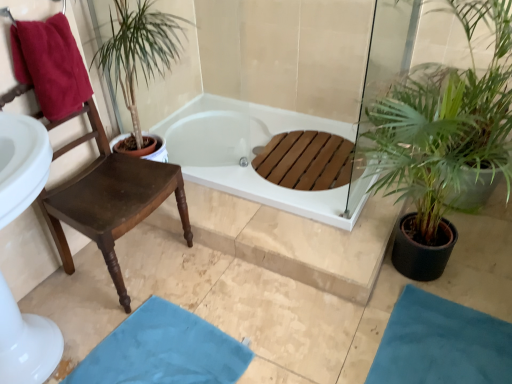
Question: Is blue fabric bath mat at lower right, which ranks as the second bath mat in left-to-right order, not inside green leafy plant at right?

Choices:
 (A) yes
 (B) no

Answer: (A)

Question: From the image's perspective, is blue fabric bath mat at lower right, which ranks as the second bath mat in left-to-right order, beneath green leafy plant at right?

Choices:
 (A) yes
 (B) no

Answer: (A)

Question: Is the surface of blue fabric bath mat at lower right, which appears as the first bath mat when viewed from the right, in direct contact with green leafy plant at right?

Choices:
 (A) yes
 (B) no

Answer: (B)

Question: Would you say green leafy plant at right is part of blue fabric bath mat at lower right, which ranks as the second bath mat in left-to-right order,'s contents?

Choices:
 (A) no
 (B) yes

Answer: (A)

Question: Considering the relative sizes of blue fabric bath mat at lower right, which ranks as the second bath mat in left-to-right order, and green leafy plant at right in the image provided, is blue fabric bath mat at lower right, which ranks as the second bath mat in left-to-right order, smaller than green leafy plant at right?

Choices:
 (A) no
 (B) yes

Answer: (B)

Question: Could you tell me if blue fabric bath mat at lower right, which ranks as the second bath mat in left-to-right order, is facing green leafy plant at right?

Choices:
 (A) no
 (B) yes

Answer: (A)

Question: From a real-world perspective, is brown wood chair at left physically below blue fabric bath mat at lower center, which is counted as the 2th bath mat, starting from the right?

Choices:
 (A) no
 (B) yes

Answer: (A)

Question: Is brown wood chair at left smaller than blue fabric bath mat at lower center, placed as the first bath mat when sorted from left to right?

Choices:
 (A) no
 (B) yes

Answer: (A)

Question: From a real-world perspective, is brown wood chair at left over blue fabric bath mat at lower center, which is counted as the 2th bath mat, starting from the right?

Choices:
 (A) no
 (B) yes

Answer: (B)

Question: Is brown wood chair at left not close to blue fabric bath mat at lower center, placed as the first bath mat when sorted from left to right?

Choices:
 (A) yes
 (B) no

Answer: (B)

Question: From the image's perspective, would you say brown wood chair at left is shown under blue fabric bath mat at lower center, placed as the first bath mat when sorted from left to right?

Choices:
 (A) yes
 (B) no

Answer: (B)

Question: From the image's perspective, is brown wood chair at left located above blue fabric bath mat at lower center, placed as the first bath mat when sorted from left to right?

Choices:
 (A) no
 (B) yes

Answer: (B)

Question: Does green leafy plant at right appear on the right side of blue fabric bath mat at lower right, which appears as the first bath mat when viewed from the right?

Choices:
 (A) yes
 (B) no

Answer: (A)